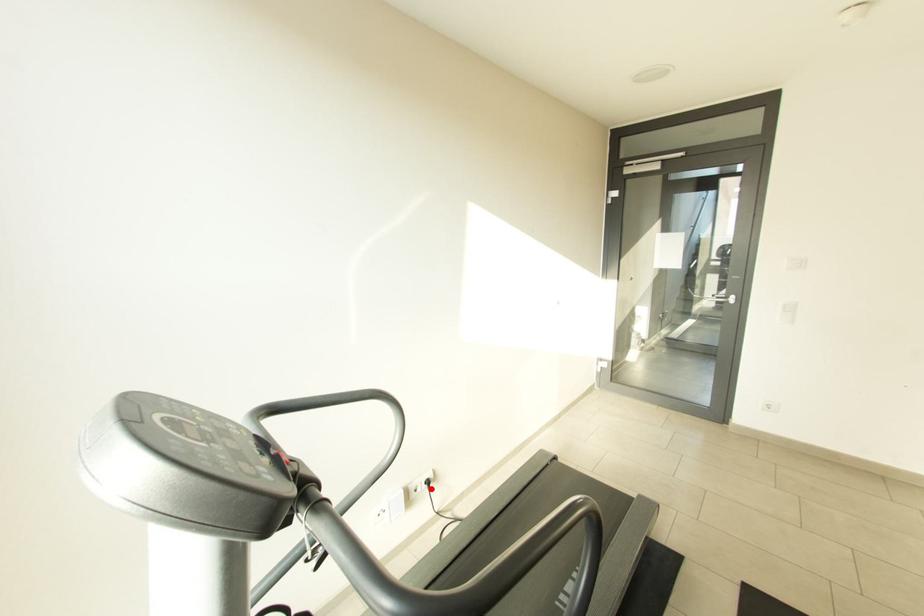
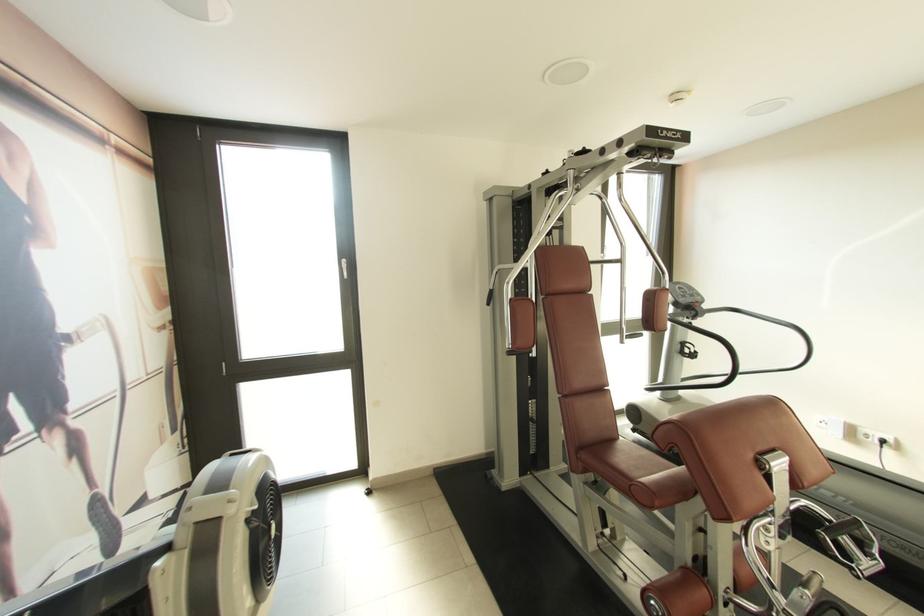
In the second image, find the point that corresponds to the highlighted location in the first image.

(882, 445)